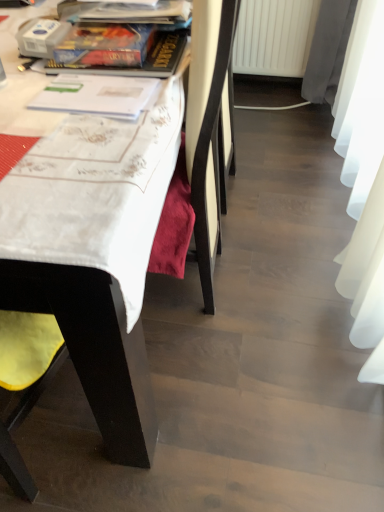
What do you see at coordinates (94, 346) in the screenshot? Image resolution: width=384 pixels, height=512 pixels. I see `yellow fabric chair at left` at bounding box center [94, 346].

Describe the element at coordinates (274, 37) in the screenshot. This screenshot has width=384, height=512. I see `white plastic radiator at lower center` at that location.

At what (x,y) coordinates should I click in order to perform the action: click on matte plastic book at upper center, positioned as the 2th book in front-to-back order. Please return your answer as a coordinate pair (x, y). Looking at the image, I should click on (125, 12).

You are a GUI agent. You are given a task and a screenshot of the screen. Output one action in this format:
    pyautogui.click(x=<x>, y=<y>)
    Task: Click on the hardcover book at upper left, which is the 2th book in back-to-front order
    
    Given the screenshot: What is the action you would take?
    pyautogui.click(x=134, y=66)

Is yellow fabric chair at left thinner than white plastic radiator at lower center?

In fact, yellow fabric chair at left might be wider than white plastic radiator at lower center.

Is white plastic radiator at lower center at the back of yellow fabric chair at left?

No, yellow fabric chair at left's orientation is not away from white plastic radiator at lower center.

Would you say yellow fabric chair at left is inside or outside white plastic radiator at lower center?

yellow fabric chair at left is outside white plastic radiator at lower center.

Based on the photo, how many degrees apart are the facing directions of yellow fabric chair at left and white plastic radiator at lower center?

They differ by 86.9 degrees in their facing directions.

From a real-world perspective, is white plastic radiator at lower center beneath hardcover book at upper left, which ranks as the 1th book in bottom-to-top order?

Yes, from a real-world perspective, white plastic radiator at lower center is below hardcover book at upper left, which ranks as the 1th book in bottom-to-top order.

Between point (301, 67) and point (61, 64), which one is positioned in front?

Positioned in front is point (61, 64).

Is white plastic radiator at lower center turned away from hardcover book at upper left, which is the 2th book in back-to-front order?

No.

Is white plastic radiator at lower center wider or thinner than hardcover book at upper left, which appears as the second book when viewed from the top?

In the image, white plastic radiator at lower center appears to be more narrow than hardcover book at upper left, which appears as the second book when viewed from the top.

Between hardcover book at upper left, which appears as the second book when viewed from the top, and yellow fabric chair at left, which one appears on the left side from the viewer's perspective?

From the viewer's perspective, yellow fabric chair at left appears more on the left side.

Considering the sizes of hardcover book at upper left, which ranks as the 1th book in front-to-back order, and yellow fabric chair at left in the image, is hardcover book at upper left, which ranks as the 1th book in front-to-back order, taller or shorter than yellow fabric chair at left?

Considering their sizes, hardcover book at upper left, which ranks as the 1th book in front-to-back order, has less height than yellow fabric chair at left.

From a real-world perspective, is hardcover book at upper left, which is the 2th book in back-to-front order, under yellow fabric chair at left?

No, from a real-world perspective, hardcover book at upper left, which is the 2th book in back-to-front order, is not below yellow fabric chair at left.

Is hardcover book at upper left, which ranks as the 1th book in front-to-back order, positioned far away from yellow fabric chair at left?

That's not correct — hardcover book at upper left, which ranks as the 1th book in front-to-back order, is a little close to yellow fabric chair at left.

From a real-world perspective, which is physically below, matte plastic book at upper center, the 1th book when ordered from back to front, or yellow fabric chair at left?

From a 3D spatial view, yellow fabric chair at left is below.

Considering the sizes of matte plastic book at upper center, arranged as the 2th book when ordered from the bottom, and yellow fabric chair at left in the image, is matte plastic book at upper center, arranged as the 2th book when ordered from the bottom, taller or shorter than yellow fabric chair at left?

In the image, matte plastic book at upper center, arranged as the 2th book when ordered from the bottom, appears to be shorter than yellow fabric chair at left.

Measure the distance from matte plastic book at upper center, placed as the first book when sorted from top to bottom, to yellow fabric chair at left.

matte plastic book at upper center, placed as the first book when sorted from top to bottom, is 23.44 inches away from yellow fabric chair at left.

Does point (166, 1) appear closer or farther from the camera than point (47, 193)?

Point (166, 1) is farther from the camera than point (47, 193).

Is yellow fabric chair at left in contact with matte plastic book at upper center, arranged as the 2th book when ordered from the bottom?

No, yellow fabric chair at left is not touching matte plastic book at upper center, arranged as the 2th book when ordered from the bottom.

Is yellow fabric chair at left thinner than matte plastic book at upper center, placed as the first book when sorted from top to bottom?

In fact, yellow fabric chair at left might be wider than matte plastic book at upper center, placed as the first book when sorted from top to bottom.

Is yellow fabric chair at left smaller than matte plastic book at upper center, arranged as the 2th book when ordered from the bottom?

No.

Who is shorter, yellow fabric chair at left or matte plastic book at upper center, placed as the first book when sorted from top to bottom?

matte plastic book at upper center, placed as the first book when sorted from top to bottom.

Between point (69, 70) and point (107, 22), which one is positioned behind?

The point (107, 22) is farther.

In the scene shown: Relative to matte plastic book at upper center, placed as the first book when sorted from top to bottom, is hardcover book at upper left, which appears as the second book when viewed from the top, in front or behind?

Visually, hardcover book at upper left, which appears as the second book when viewed from the top, is located in front of matte plastic book at upper center, placed as the first book when sorted from top to bottom.

Considering the positions of objects hardcover book at upper left, which ranks as the 1th book in front-to-back order, and matte plastic book at upper center, arranged as the 2th book when ordered from the bottom, in the image provided, who is more to the right, hardcover book at upper left, which ranks as the 1th book in front-to-back order, or matte plastic book at upper center, arranged as the 2th book when ordered from the bottom,?

hardcover book at upper left, which ranks as the 1th book in front-to-back order, is more to the right.

Based on the photo, considering the positions of objects white plastic radiator at lower center and matte plastic book at upper center, placed as the first book when sorted from top to bottom, in the image provided, who is behind, white plastic radiator at lower center or matte plastic book at upper center, placed as the first book when sorted from top to bottom,?

white plastic radiator at lower center is more distant.

From the image's perspective, is white plastic radiator at lower center beneath matte plastic book at upper center, the 1th book when ordered from back to front?

Incorrect, from the image's perspective, white plastic radiator at lower center is higher than matte plastic book at upper center, the 1th book when ordered from back to front.

Are white plastic radiator at lower center and matte plastic book at upper center, placed as the first book when sorted from top to bottom, far apart?

Yes, white plastic radiator at lower center and matte plastic book at upper center, placed as the first book when sorted from top to bottom, are located far from each other.

Considering the relative sizes of white plastic radiator at lower center and matte plastic book at upper center, positioned as the 2th book in front-to-back order, in the image provided, is white plastic radiator at lower center shorter than matte plastic book at upper center, positioned as the 2th book in front-to-back order,?

In fact, white plastic radiator at lower center may be taller than matte plastic book at upper center, positioned as the 2th book in front-to-back order.

The image size is (384, 512). Find the location of `chair located below the white plastic radiator at lower center (from the image's perspective)`. chair located below the white plastic radiator at lower center (from the image's perspective) is located at coordinates point(94,346).

This screenshot has width=384, height=512. Find the location of `radiator lying above the hardcover book at upper left, which appears as the second book when viewed from the top (from the image's perspective)`. radiator lying above the hardcover book at upper left, which appears as the second book when viewed from the top (from the image's perspective) is located at coordinates (274, 37).

Based on their spatial positions, is white plastic radiator at lower center or yellow fabric chair at left further from matte plastic book at upper center, positioned as the 2th book in front-to-back order?

white plastic radiator at lower center is positioned further to the anchor matte plastic book at upper center, positioned as the 2th book in front-to-back order.

Consider the image. From the image, which object appears to be farther from white plastic radiator at lower center, yellow fabric chair at left or hardcover book at upper left, which appears as the second book when viewed from the top?

yellow fabric chair at left lies further to white plastic radiator at lower center than the other object.

Considering their positions, is yellow fabric chair at left positioned further to hardcover book at upper left, which is the 2th book in back-to-front order, than white plastic radiator at lower center?

white plastic radiator at lower center is further to hardcover book at upper left, which is the 2th book in back-to-front order.

Consider the image. Estimate the real-world distances between objects in this image. Which object is further from hardcover book at upper left, which ranks as the 1th book in bottom-to-top order, yellow fabric chair at left or matte plastic book at upper center, positioned as the 2th book in front-to-back order?

yellow fabric chair at left is positioned further to the anchor hardcover book at upper left, which ranks as the 1th book in bottom-to-top order.

When comparing their distances from yellow fabric chair at left, does matte plastic book at upper center, arranged as the 2th book when ordered from the bottom, or hardcover book at upper left, which is the 2th book in back-to-front order, seem further?

The object further to yellow fabric chair at left is matte plastic book at upper center, arranged as the 2th book when ordered from the bottom.

Estimate the real-world distances between objects in this image. Which object is closer to white plastic radiator at lower center, yellow fabric chair at left or matte plastic book at upper center, the 1th book when ordered from back to front?

matte plastic book at upper center, the 1th book when ordered from back to front.

Considering their positions, is white plastic radiator at lower center positioned further to yellow fabric chair at left than hardcover book at upper left, which ranks as the 1th book in bottom-to-top order?

white plastic radiator at lower center.

Based on their spatial positions, is white plastic radiator at lower center or matte plastic book at upper center, positioned as the 2th book in front-to-back order, closer to hardcover book at upper left, which appears as the second book when viewed from the top?

matte plastic book at upper center, positioned as the 2th book in front-to-back order.

At what (x,y) coordinates should I click in order to perform the action: click on book positioned between hardcover book at upper left, which ranks as the 1th book in bottom-to-top order, and white plastic radiator at lower center from near to far. Please return your answer as a coordinate pair (x, y). The width and height of the screenshot is (384, 512). Looking at the image, I should click on (x=125, y=12).

The image size is (384, 512). Find the location of `book positioned between yellow fabric chair at left and matte plastic book at upper center, placed as the first book when sorted from top to bottom, from near to far`. book positioned between yellow fabric chair at left and matte plastic book at upper center, placed as the first book when sorted from top to bottom, from near to far is located at coordinates (134, 66).